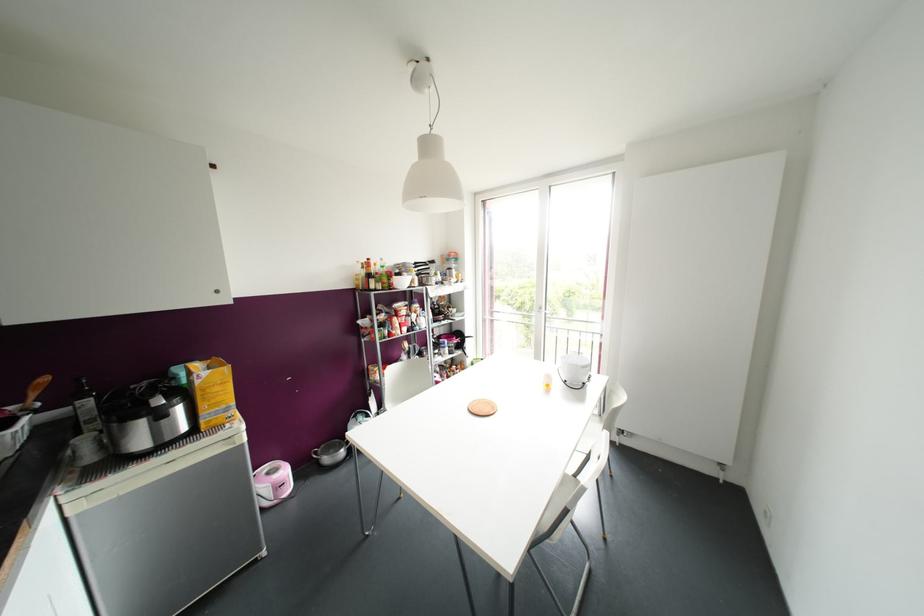
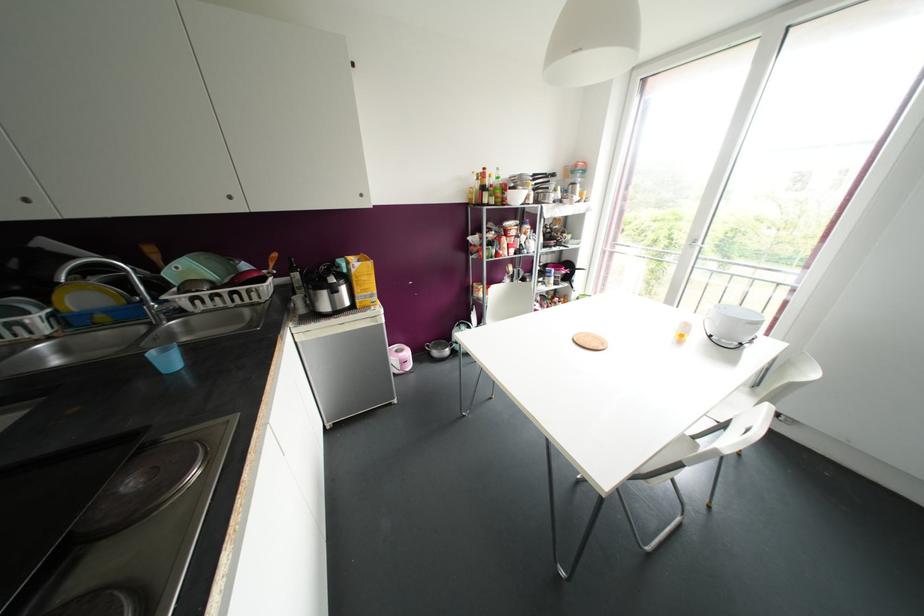
Which direction would the cameraman need to move to produce the second image?

The movement direction of the cameraman is left, forward.